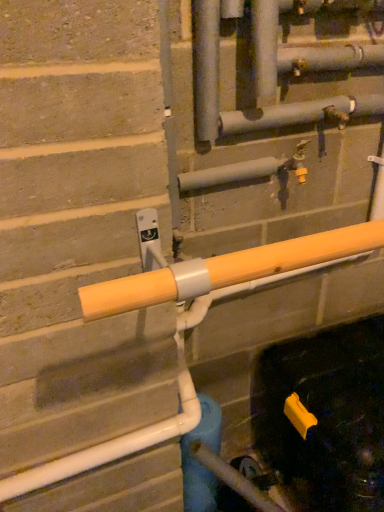
Question: Looking at the image, does yellow plastic faucet at center seem bigger or smaller compared to blue matte water pipe at center?

Choices:
 (A) big
 (B) small

Answer: (B)

Question: From a real-world perspective, is yellow plastic faucet at center above or below blue matte water pipe at center?

Choices:
 (A) above
 (B) below

Answer: (A)

Question: Considering the real-world distances, which object is farthest from the yellow matte pipe at center?

Choices:
 (A) blue matte water pipe at center
 (B) yellow plastic faucet at center

Answer: (A)

Question: Estimate the real-world distances between objects in this image. Which object is closer to the yellow plastic faucet at center?

Choices:
 (A) blue matte water pipe at center
 (B) yellow matte pipe at center

Answer: (B)